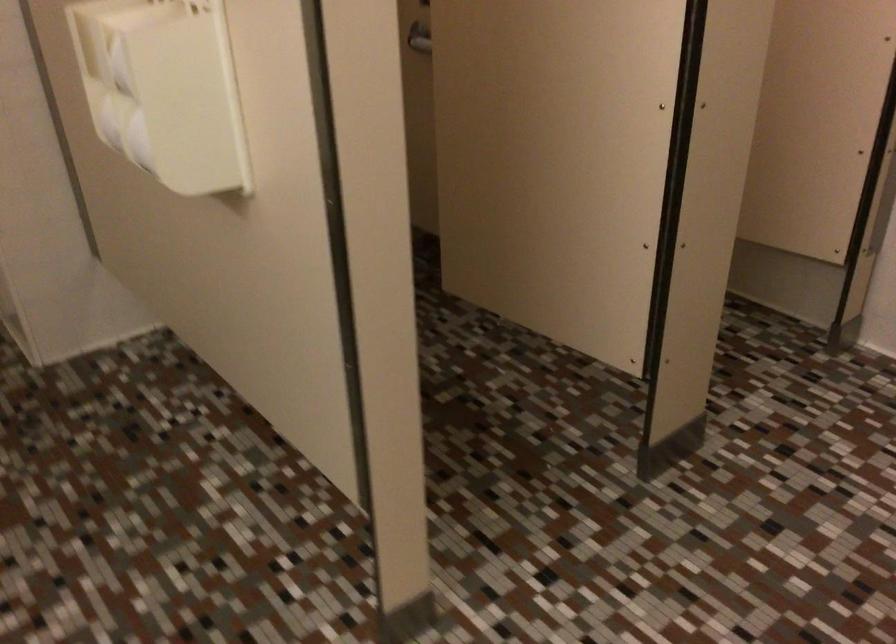
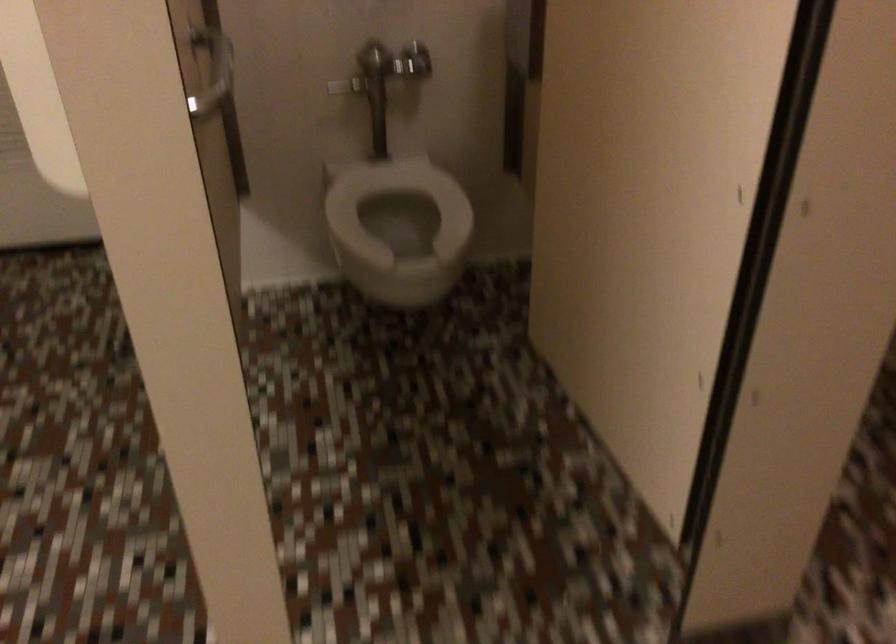
Question: The camera is either moving clockwise (left) or counter-clockwise (right) around the object. The first image is from the beginning of the video and the second image is from the end. Is the camera moving left or right when shooting the video?

Choices:
 (A) Left
 (B) Right

Answer: (B)